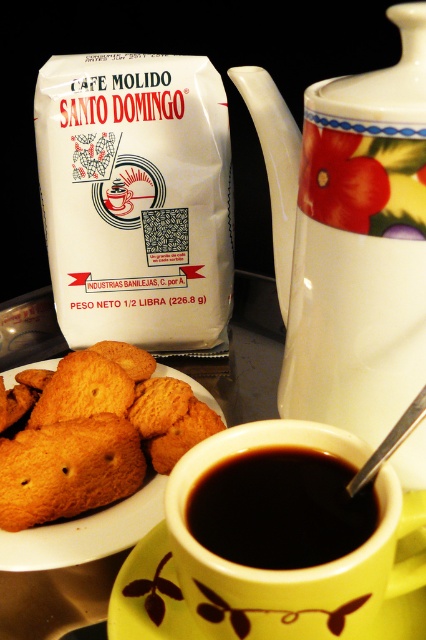
Based on the photo, is white glossy teapot at upper right wider than yellow ceramic saucer at lower center?

In fact, white glossy teapot at upper right might be narrower than yellow ceramic saucer at lower center.

Who is more forward, (316, 141) or (423, 636)?

Positioned in front is point (423, 636).

In order to click on white glossy teapot at upper right in this screenshot , I will do `click(350, 236)`.

Does point (94, 448) come closer to viewer compared to point (152, 582)?

No, it is not.

Who is more forward, (x=114, y=385) or (x=420, y=627)?

Point (x=420, y=627) is more forward.

The height and width of the screenshot is (640, 426). I want to click on golden crispy cookie at center, so click(95, 436).

The height and width of the screenshot is (640, 426). What are the coordinates of `black matte cup at center` in the screenshot? It's located at (281, 509).

Which is in front, point (291, 452) or point (385, 608)?

Point (291, 452)

Locate an element on the screen. black matte cup at center is located at coordinates (281, 509).